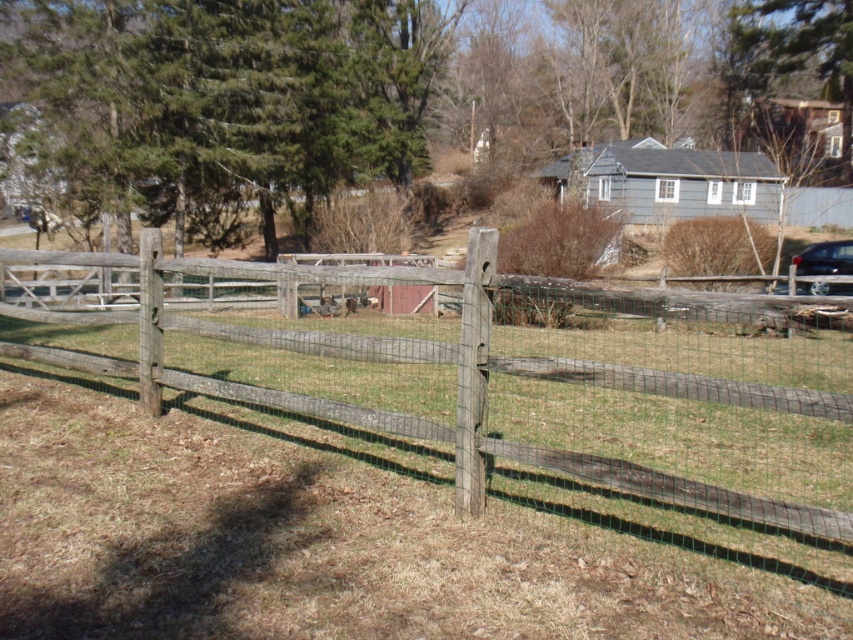
Is point (102, 323) closer to camera compared to point (848, 240)?

Yes, point (102, 323) is closer to viewer.

At what (x,y) coordinates should I click in order to perform the action: click on weathered wood fence at center. Please return your answer as a coordinate pair (x, y). The width and height of the screenshot is (853, 640). Looking at the image, I should click on (498, 385).